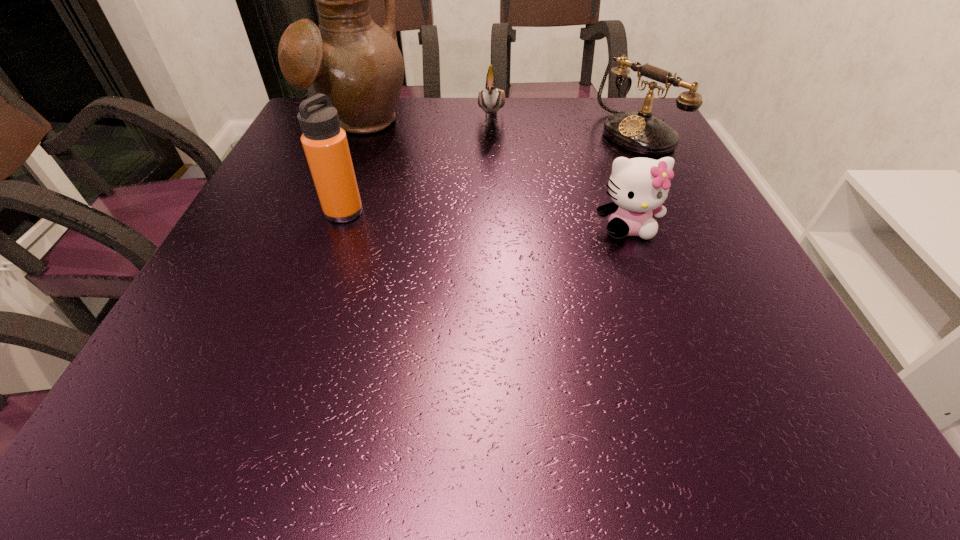
Image resolution: width=960 pixels, height=540 pixels. In order to click on free point located at the face of the third object from left to right in this screenshot , I will do `click(488, 168)`.

Where is `blank space located 0.250m at the face of the third object from left to right`? The width and height of the screenshot is (960, 540). blank space located 0.250m at the face of the third object from left to right is located at coordinates (485, 197).

In order to click on vacant area situated at the face of the third object from left to right in this screenshot , I will do `click(490, 148)`.

This screenshot has width=960, height=540. Find the location of `vacant position located 0.190m on the dial of the telephone`. vacant position located 0.190m on the dial of the telephone is located at coordinates (562, 178).

The height and width of the screenshot is (540, 960). What are the coordinates of `free space located 0.290m on the dial of the telephone` in the screenshot? It's located at (529, 195).

Identify the location of free region located 0.080m on the dial of the telephone. The height and width of the screenshot is (540, 960). (594, 162).

Locate an element on the screen. The height and width of the screenshot is (540, 960). pitcher present at the far edge is located at coordinates (349, 58).

Locate an element on the screen. The width and height of the screenshot is (960, 540). bird present at the far edge is located at coordinates (491, 99).

At what (x,y) coordinates should I click in order to perform the action: click on telephone situated at the far edge. Please return your answer as a coordinate pair (x, y). The image size is (960, 540). Looking at the image, I should click on (640, 132).

The height and width of the screenshot is (540, 960). I want to click on object present at the left edge, so click(349, 58).